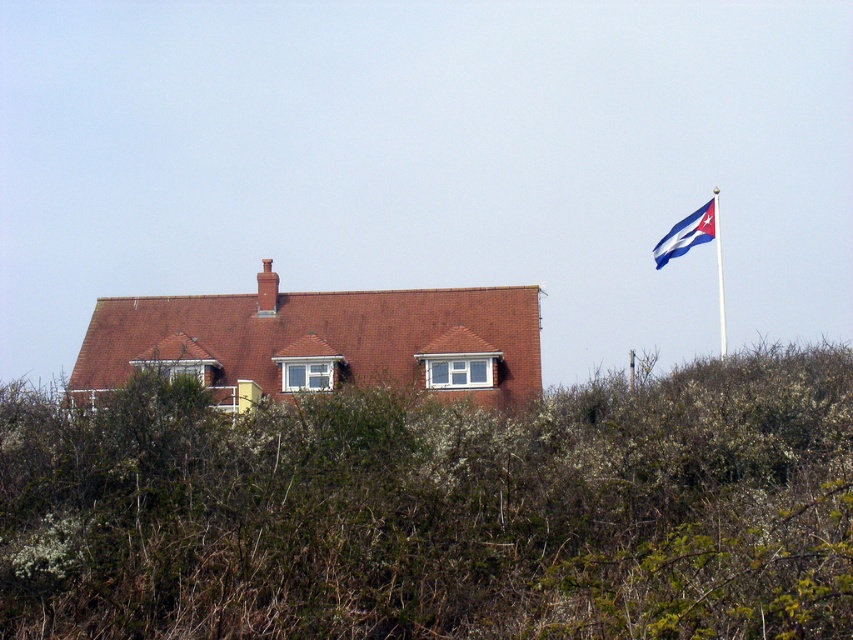
Question: Can you confirm if blue fabric flag at upper right is positioned below white plastic flag pole at upper right?

Choices:
 (A) yes
 (B) no

Answer: (B)

Question: Can you confirm if blue fabric flag at upper right is thinner than white plastic flag pole at upper right?

Choices:
 (A) yes
 (B) no

Answer: (A)

Question: Which point is farther from the camera taking this photo?

Choices:
 (A) (714, 196)
 (B) (677, 234)

Answer: (A)

Question: Does blue fabric flag at upper right have a smaller size compared to white plastic flag pole at upper right?

Choices:
 (A) no
 (B) yes

Answer: (B)